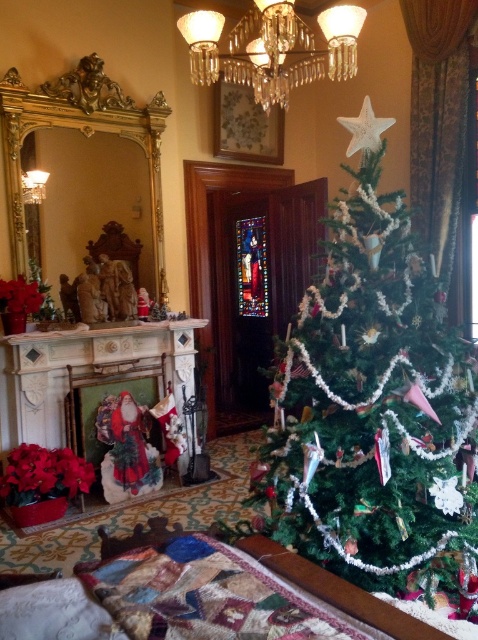
You are standing in the center of the room and want to place a new ornament on the green matte christmas tree at center. Based on its current position, which direction should you move to reach the tree?

The green matte christmas tree at center is located at point (375, 410), so you should move to the right and slightly forward to reach it.

You are a delivery person who just arrived at a house to deliver a package. You are standing in the living room and see the green matte christmas tree at center and the clear crystal chandelier at upper center. The package is too large to carry through a narrow hallway behind the tree. You need to place the package on the floor between these two items. Is there enough space between them to place the package?

The green matte christmas tree at center is 4.52 feet away from the clear crystal chandelier at upper center. Since the distance between them is over 4 feet, there should be enough space to place the package between them as long as the package isn

You are standing in the room and want to place a small decoration on the mantel. You have two points marked on the mantel where you can place it. The first point is at coordinate point(274, 445) and the second is at point(194, 45). Which point is closer to you so that the decoration is more visible?

Point(274, 445) is closer to the viewer than point(194, 45). Therefore, placing the decoration at point(274, 445) will make it more visible.